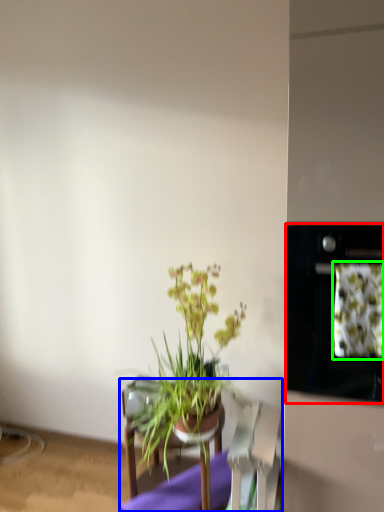
Question: Which object is the farthest from oven (highlighted by a red box)? Choose among these: furniture (highlighted by a blue box) or flower (highlighted by a green box).

Choices:
 (A) furniture
 (B) flower

Answer: (A)